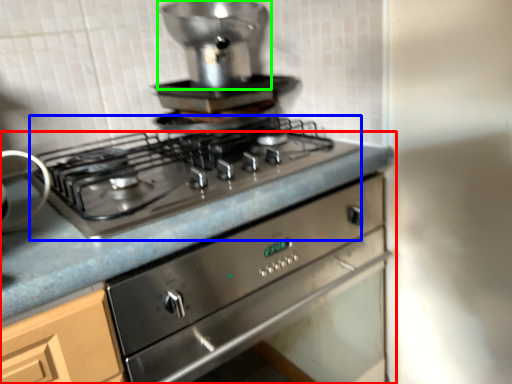
Question: Which object is the closest to the countertop (highlighted by a red box)? Choose among these: gas stove (highlighted by a blue box) or appliance (highlighted by a green box).

Choices:
 (A) gas stove
 (B) appliance

Answer: (A)